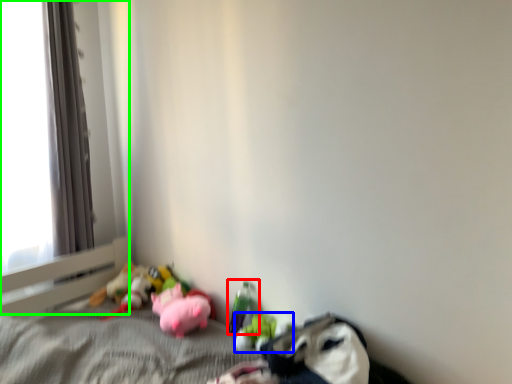
Question: Considering the real-world distances, which object is closest to toy (highlighted by a red box)? toy (highlighted by a blue box) or window frame (highlighted by a green box).

Choices:
 (A) toy
 (B) window frame

Answer: (A)